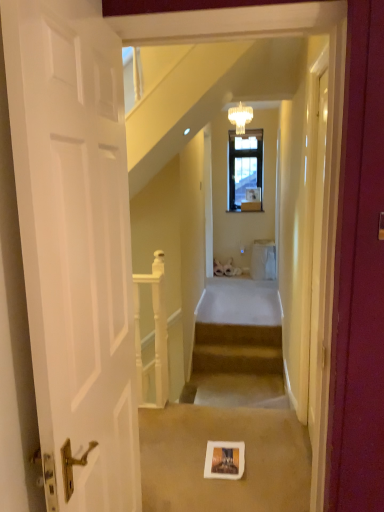
Question: Which is correct: carpeted stairs at center is inside white cardboard picture frame at center, or outside of it?

Choices:
 (A) outside
 (B) inside

Answer: (A)

Question: From a real-world perspective, is carpeted stairs at center positioned above or below white cardboard picture frame at center?

Choices:
 (A) above
 (B) below

Answer: (B)

Question: Which is nearer to the white wooden railing at center?

Choices:
 (A) carpeted stairs at center
 (B) white cardboard picture frame at center
 (C) crystal glass chandelier at upper center

Answer: (B)

Question: Estimate the real-world distances between objects in this image. Which object is closer to the carpeted stairs at center?

Choices:
 (A) white cardboard picture frame at center
 (B) white wooden railing at center
 (C) crystal glass chandelier at upper center

Answer: (B)